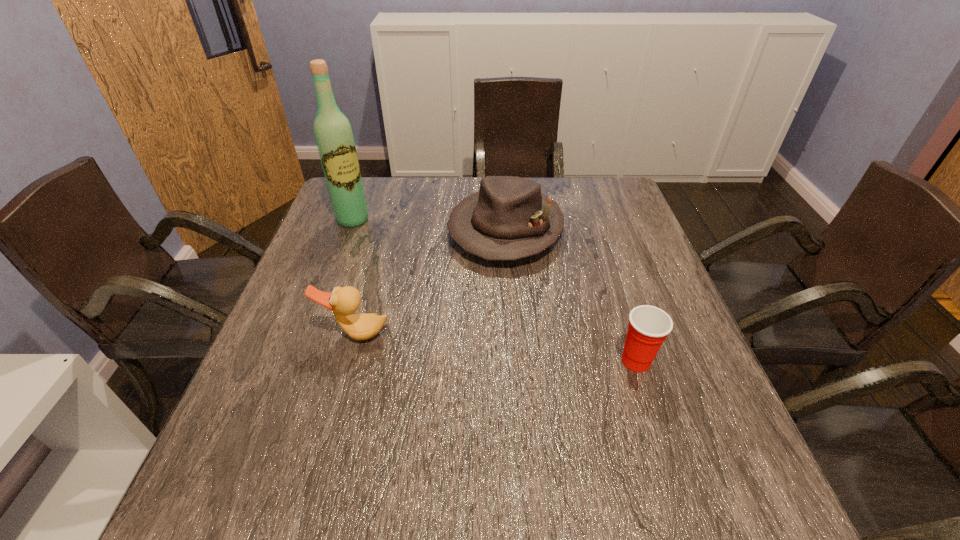
Locate an element on the screen. The image size is (960, 540). free space between the tallest object and the nearest object is located at coordinates (494, 291).

Find the location of a particular element. vacant area that lies between the second nearest object and the nearest object is located at coordinates (495, 347).

Locate an element on the screen. The width and height of the screenshot is (960, 540). vacant space in between the third farthest object and the tallest object is located at coordinates (354, 276).

Where is `free point between the third farthest object and the Dixie cup`? free point between the third farthest object and the Dixie cup is located at coordinates (495, 347).

Find the location of `free spot between the duck and the hat`. free spot between the duck and the hat is located at coordinates tap(431, 281).

Choose which object is the nearest neighbor to the nearest object. Please provide its 2D coordinates. Your answer should be formatted as a tuple, i.e. [(x, y)], where the tuple contains the x and y coordinates of a point satisfying the conditions above.

[(509, 218)]

Identify which object is located as the nearest to the third farthest object. Please provide its 2D coordinates. Your answer should be formatted as a tuple, i.e. [(x, y)], where the tuple contains the x and y coordinates of a point satisfying the conditions above.

[(509, 218)]

Identify the location of vacant space that satisfies the following two spatial constraints: 1. on the beak of the second nearest object; 2. on the right side of the nearest object. (348, 361).

Locate an element on the screen. This screenshot has width=960, height=540. vacant region that satisfies the following two spatial constraints: 1. on the beak of the Dixie cup; 2. on the left side of the third farthest object is located at coordinates (348, 361).

This screenshot has height=540, width=960. What are the coordinates of `free space that satisfies the following two spatial constraints: 1. on the beak of the duck; 2. on the right side of the rightmost object` in the screenshot? It's located at (348, 361).